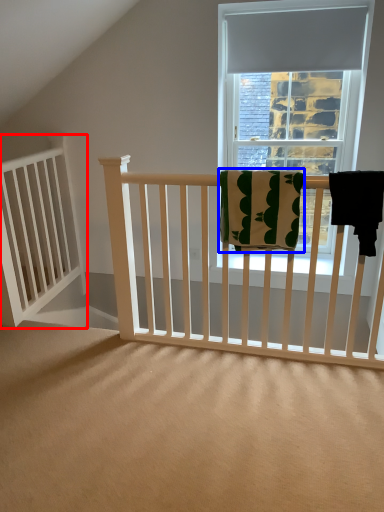
Question: Which point is closer to the camera, balustrade (highlighted by a red box) or beach towel (highlighted by a blue box)?

Choices:
 (A) balustrade
 (B) beach towel

Answer: (B)